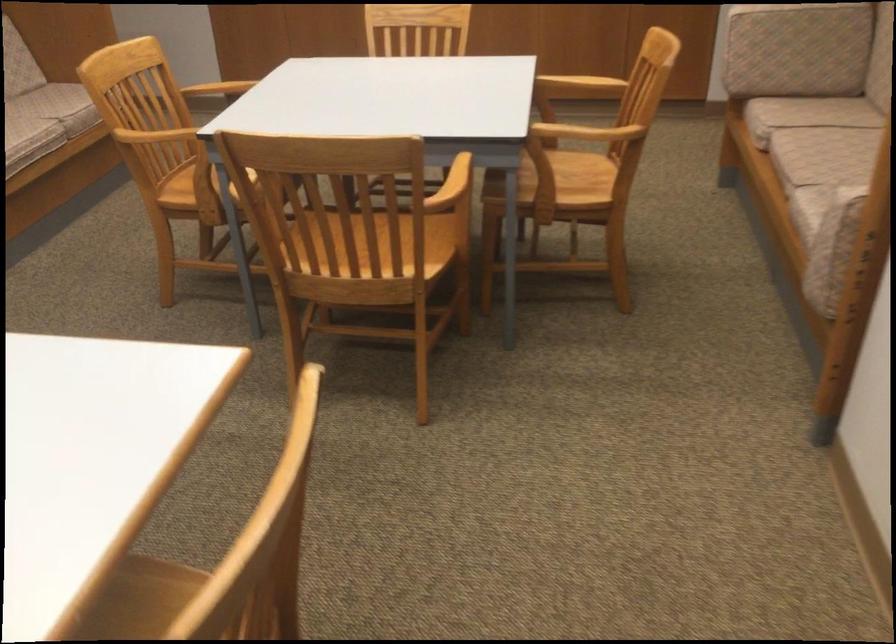
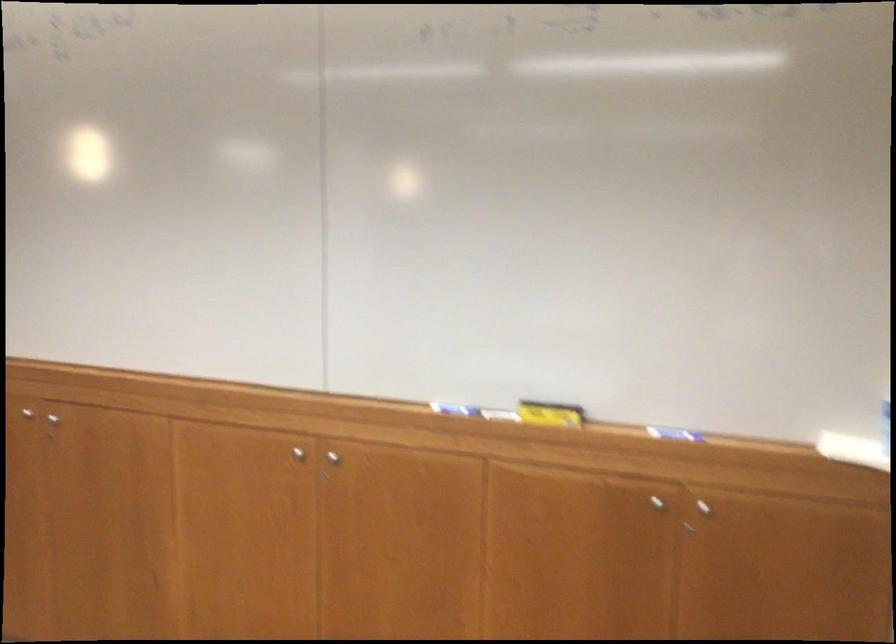
Question: What movement of the cameraman would produce the second image?

Choices:
 (A) Left
 (B) Right
 (C) Forward
 (D) Backward

Answer: (C)